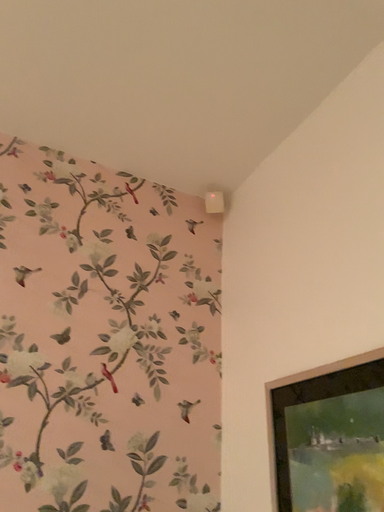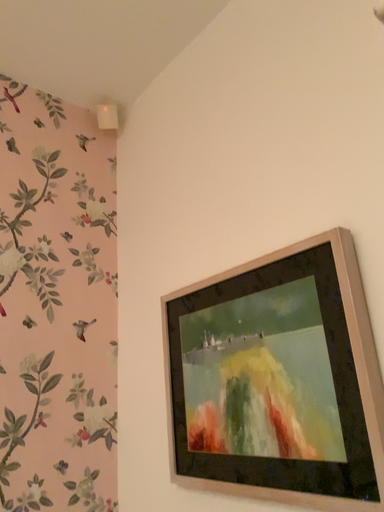
Question: How did the camera likely rotate when shooting the video?

Choices:
 (A) rotated right
 (B) rotated left

Answer: (A)